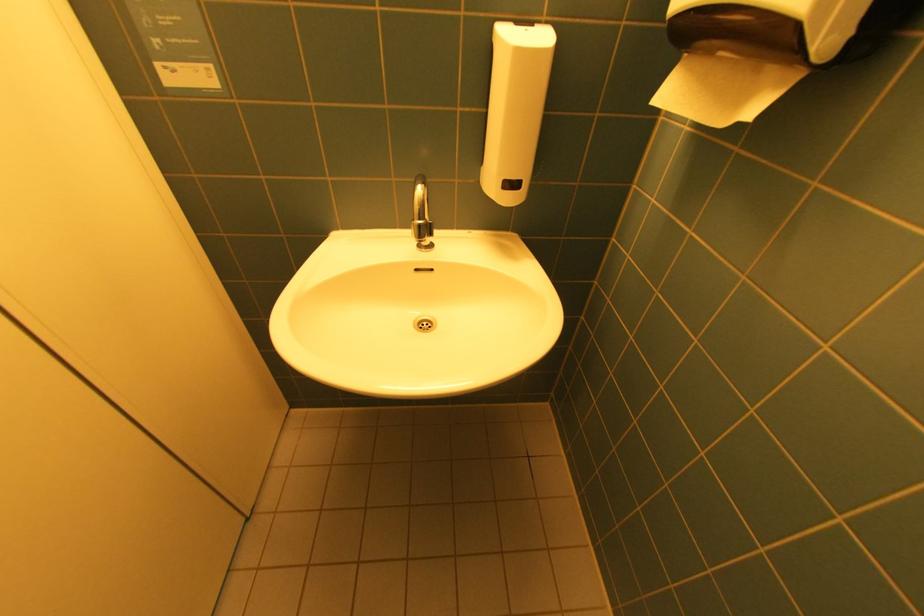
This screenshot has width=924, height=616. What are the coordinates of `chrome faucet handle` in the screenshot? It's located at (420, 215).